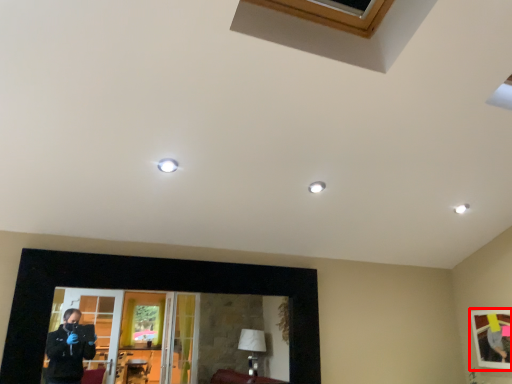
Question: Considering the relative positions of picture frame (annotated by the red box) and picture frame in the image provided, where is picture frame (annotated by the red box) located with respect to the staircase?

Choices:
 (A) right
 (B) left

Answer: (A)